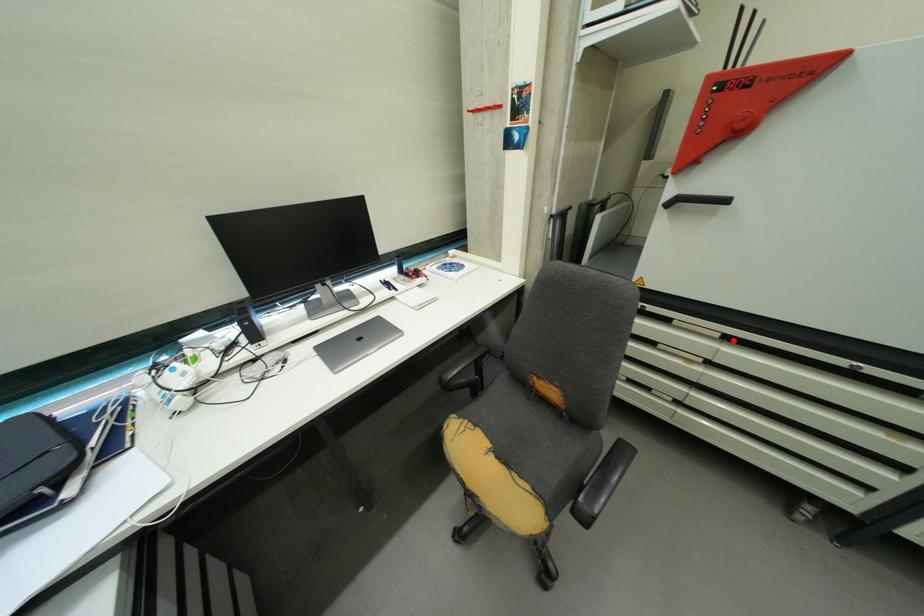
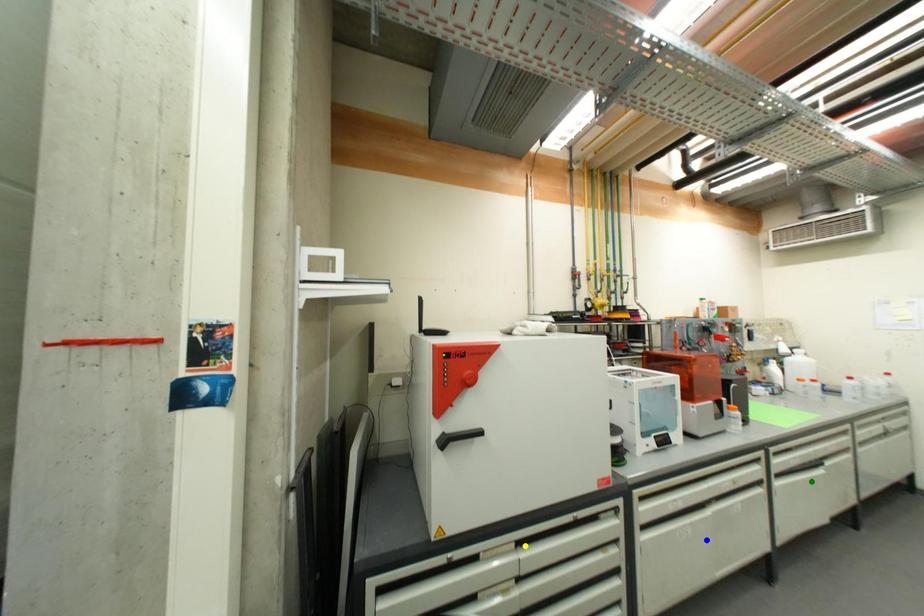
Question: I am providing you with two images of the same scene from different viewpoints. A red point is marked on the first image. You are given multiple points on the second image. Which point in image 2 represents the same 3d spot as the red point in image 1?

Choices:
 (A) yellow point
 (B) green point
 (C) blue point

Answer: (A)